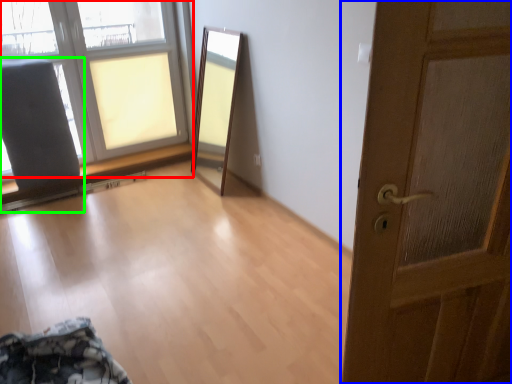
Question: Estimate the real-world distances between objects in this image. Which object is closer to window (highlighted by a red box), door (highlighted by a blue box) or armchair (highlighted by a green box)?

Choices:
 (A) door
 (B) armchair

Answer: (B)